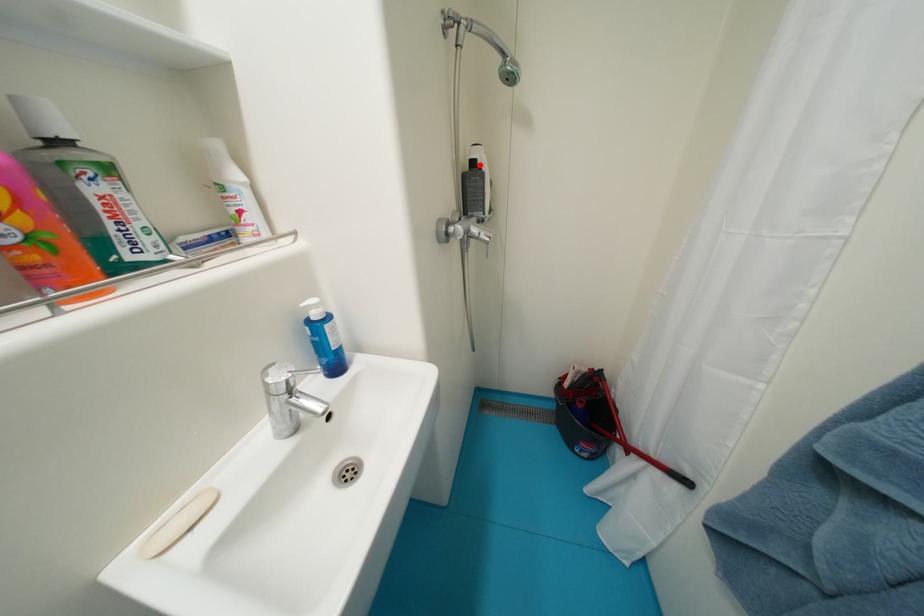
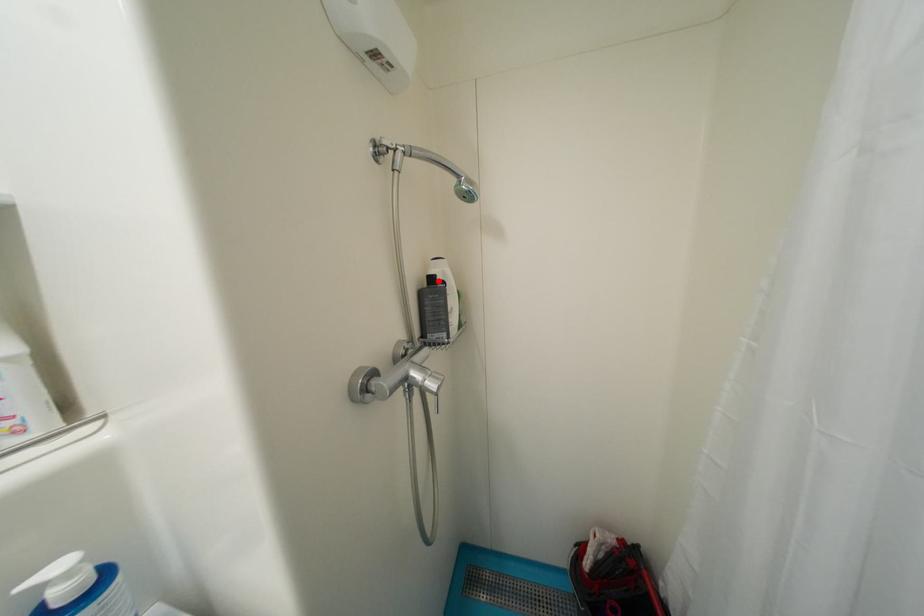
I am providing you with two images of the same scene from different viewpoints. A red point is marked on the first image and another point is marked on the second image. Are the points marked in image1 and image2 representing the same 3D position?

Yes